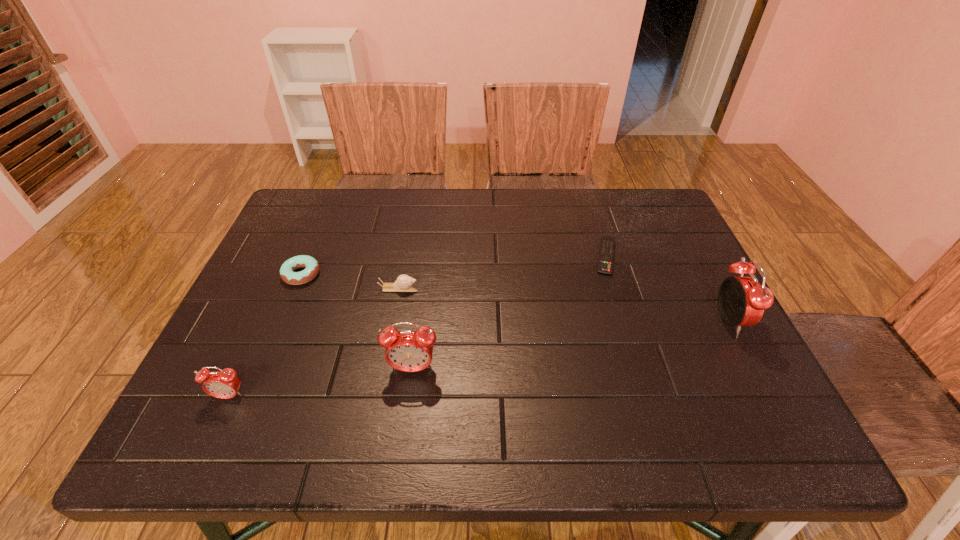
If we want them evenly spaced by inserting an extra alarm_clock among them, please locate a free spot for this new alarm_clock. Please provide its 2D coordinates. Your answer should be formatted as a tuple, i.e. [(x, y)], where the tuple contains the x and y coordinates of a point satisfying the conditions above.

[(578, 345)]